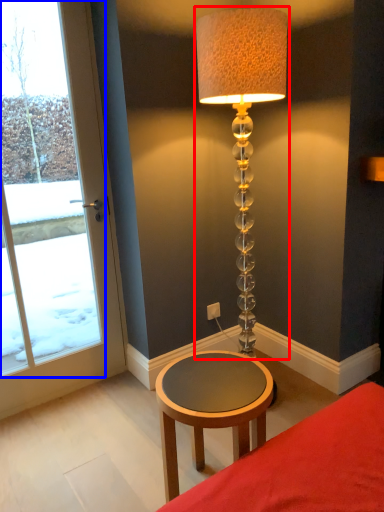
Question: Which object appears closest to the camera in this image, lamp (highlighted by a red box) or window (highlighted by a blue box)?

Choices:
 (A) lamp
 (B) window

Answer: (A)